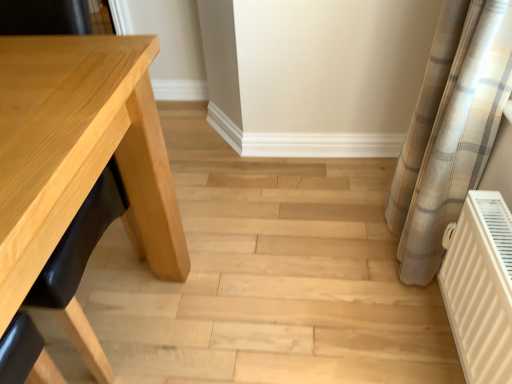
Question: Considering the positions of light wood table at left and white matte radiator at lower right in the image, is light wood table at left wider or thinner than white matte radiator at lower right?

Choices:
 (A) thin
 (B) wide

Answer: (B)

Question: In terms of size, does light wood table at left appear bigger or smaller than white matte radiator at lower right?

Choices:
 (A) big
 (B) small

Answer: (A)

Question: Which object is positioned farthest from the natural wood table at left?

Choices:
 (A) light wood table at left
 (B) plaid fabric curtain at right
 (C) white matte radiator at lower right

Answer: (C)

Question: Which object is positioned closest to the natural wood table at left?

Choices:
 (A) white matte radiator at lower right
 (B) plaid fabric curtain at right
 (C) light wood table at left

Answer: (B)